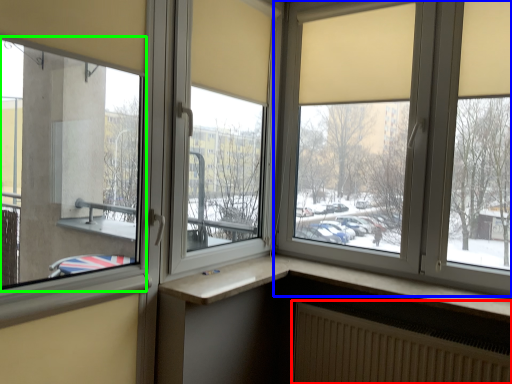
Question: Which object is the farthest from radiator (highlighted by a red box)? Choose among these: window (highlighted by a blue box) or window (highlighted by a green box).

Choices:
 (A) window
 (B) window

Answer: (B)